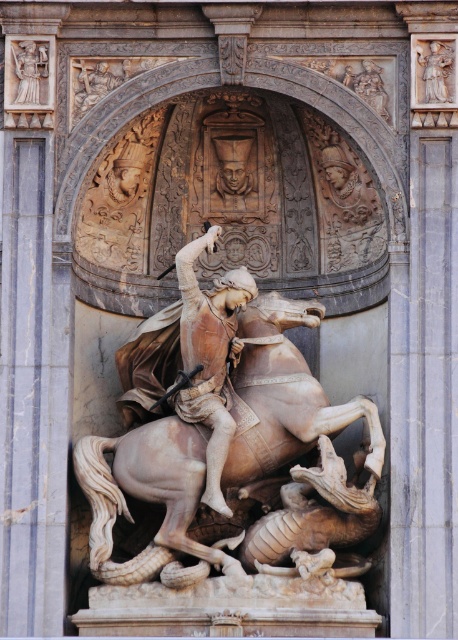
Which is above, beige marble horse at center or polished marble statue at upper left?

polished marble statue at upper left

Can you confirm if beige marble horse at center is taller than polished marble statue at upper left?

Yes, beige marble horse at center is taller than polished marble statue at upper left.

Image resolution: width=458 pixels, height=640 pixels. I want to click on beige marble horse at center, so click(x=295, y=444).

In order to click on beige marble horse at center in this screenshot , I will do `click(295, 444)`.

Does beige marble horse at center have a lesser height compared to polished marble figures at upper right?

In fact, beige marble horse at center may be taller than polished marble figures at upper right.

Is the position of beige marble horse at center more distant than that of polished marble figures at upper right?

That is False.

Where is `beige marble horse at center`? beige marble horse at center is located at coordinates (295, 444).

Who is more distant from viewer, (16, 74) or (380, 76)?

The point (380, 76) is behind.

Between polished marble statue at upper left and polished marble figures at upper right, which one has less height?

polished marble figures at upper right

Is point (43, 48) more distant than point (380, 113)?

That is True.

Find the location of a particular element. The image size is (458, 640). polished marble statue at upper left is located at coordinates (30, 70).